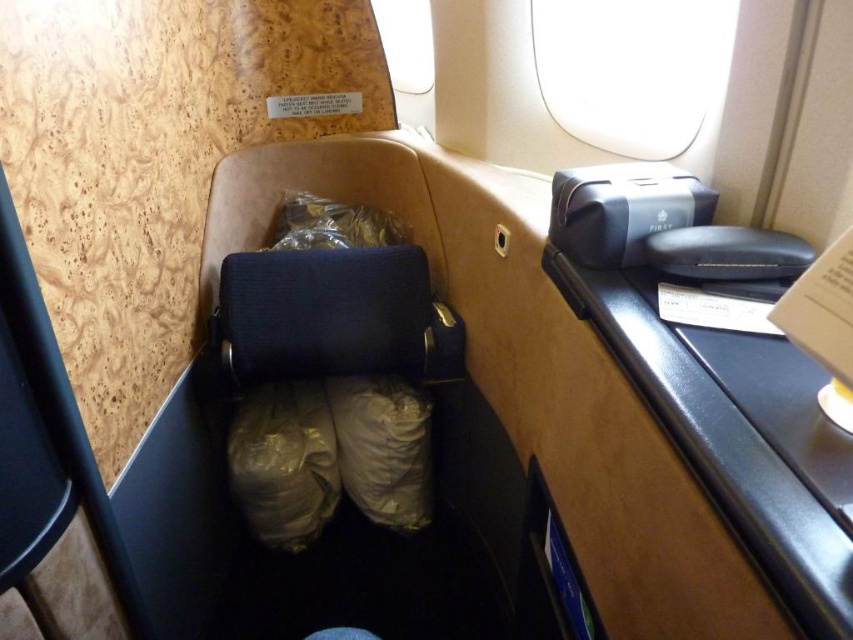
You are seated in the airplane cabin and need to reach the matte beige bag at center. Based on its position, which direction should you move to grab it?

The matte beige bag at center is located at coordinates 0.700 on the x axis and 0.450 on the y axis. Since the bag is at center, you should move forward to reach it.

You are a flight attendant checking storage compartments. You see a matte black case at upper right and a shiny gold bag at center. Which item is closer to the right side of the compartment?

The matte black case at upper right is positioned on the right side of the shiny gold bag at center, so it is closer to the right side of the compartment.

You are a flight attendant checking the overhead compartments. You notice two bags, the matte beige bag at center and the shiny gold bag at center, placed in the same compartment. Which bag is easier to grab without moving the other?

The matte beige bag at center is easier to grab because it is closer to the viewer than the shiny gold bag at center.